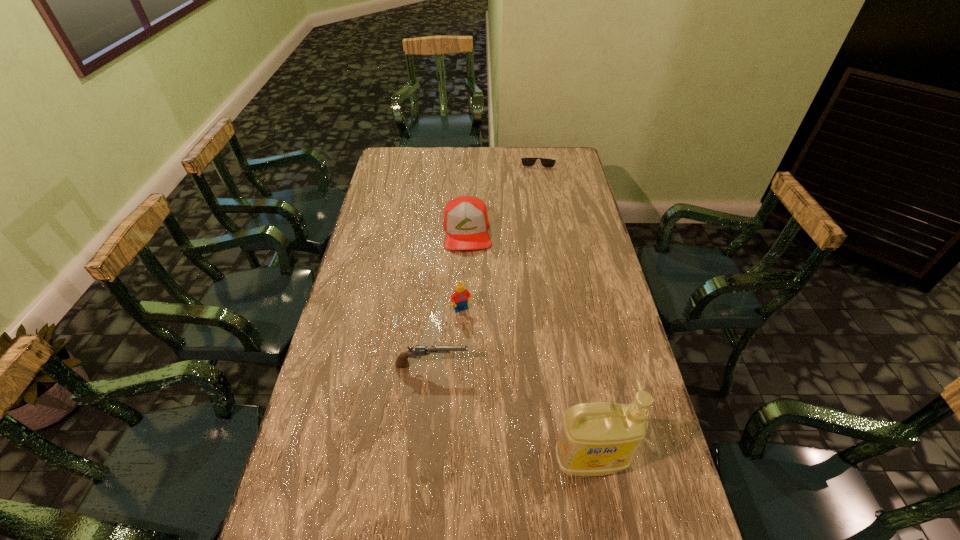
Find the location of `free spot located 0.260m on the front-facing side of the baseball cap`. free spot located 0.260m on the front-facing side of the baseball cap is located at coordinates (474, 307).

In order to click on blank space located 0.200m on the front-facing side of the baseball cap in this screenshot , I will do `click(472, 293)`.

Where is `vacant region located 0.240m on the front-facing side of the baseball cap`? The image size is (960, 540). vacant region located 0.240m on the front-facing side of the baseball cap is located at coordinates (473, 302).

This screenshot has height=540, width=960. I want to click on free space located on the face of the Lego, so click(491, 366).

Where is `vacant space situated 0.280m on the face of the Lego`? This screenshot has width=960, height=540. vacant space situated 0.280m on the face of the Lego is located at coordinates (501, 388).

This screenshot has width=960, height=540. Find the location of `vacant area located 0.160m on the face of the Lego`. vacant area located 0.160m on the face of the Lego is located at coordinates (486, 355).

Locate an element on the screen. This screenshot has width=960, height=540. free space located on the front-facing side of the farthest object is located at coordinates (538, 174).

This screenshot has width=960, height=540. Identify the location of blank space located on the front-facing side of the farthest object. (536, 218).

Locate an element on the screen. This screenshot has width=960, height=540. free spot located on the front-facing side of the farthest object is located at coordinates (536, 204).

Where is `object positioned at the far edge`? object positioned at the far edge is located at coordinates (545, 162).